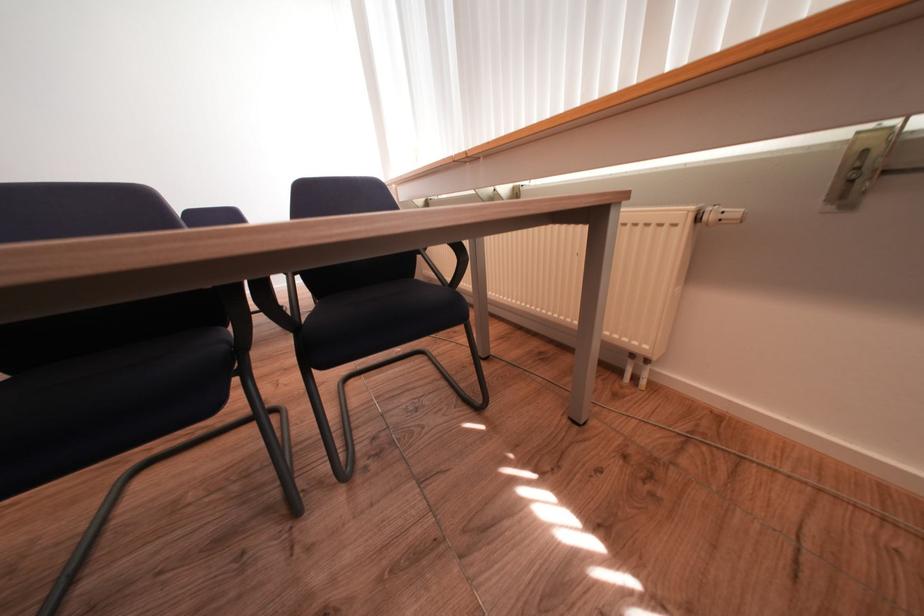
What do you see at coordinates (391, 312) in the screenshot? I see `the black chair sitting surface` at bounding box center [391, 312].